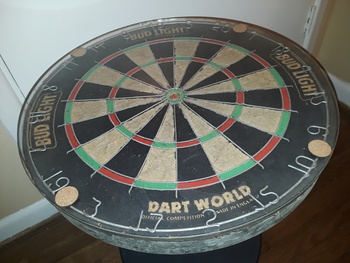
Where is `hinge`? This screenshot has height=263, width=350. hinge is located at coordinates (312, 23).